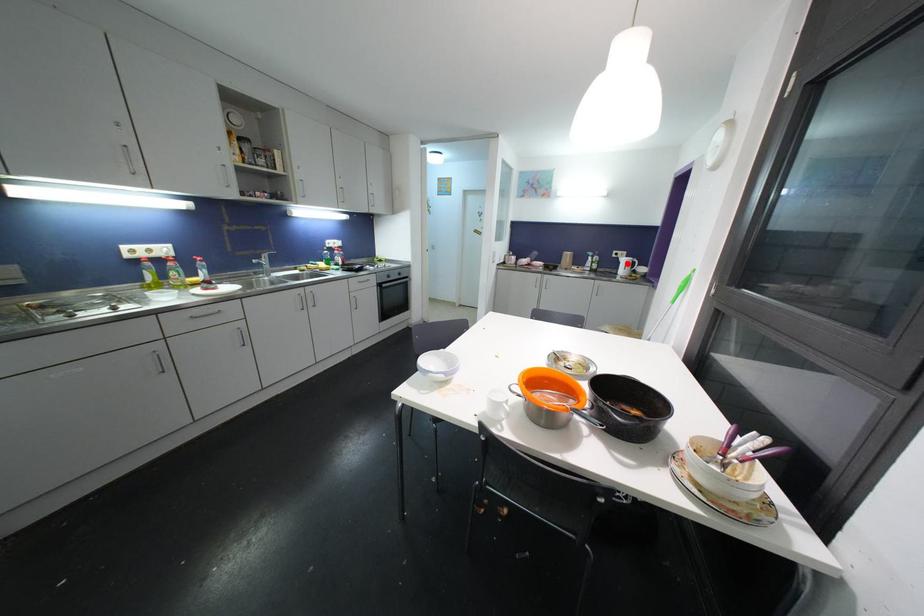
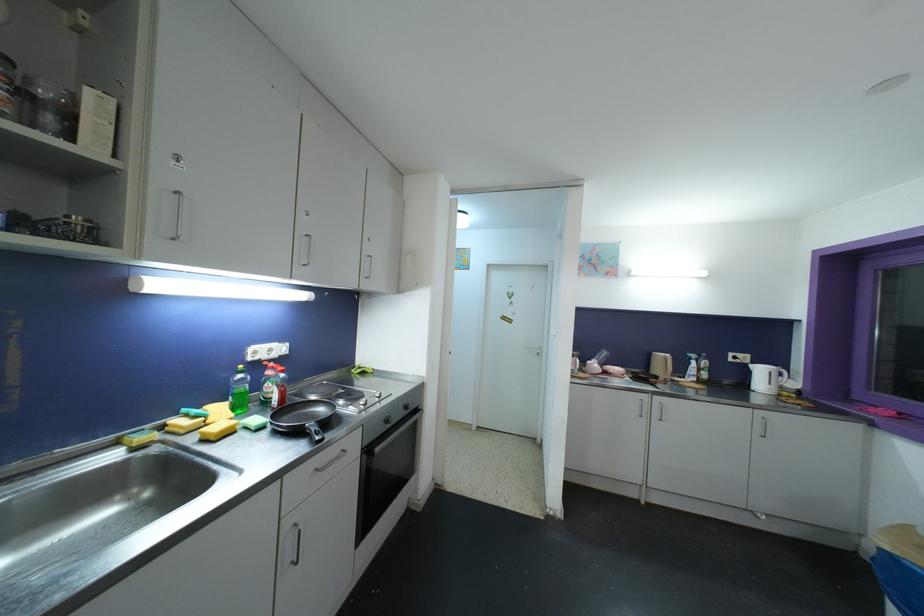
Question: I am providing you with two images of the same scene from different viewpoints. A red point is shown in image1. For the corresponding object point in image2, is it positioned nearer or farther from the camera?

Choices:
 (A) Nearer
 (B) Farther

Answer: (B)